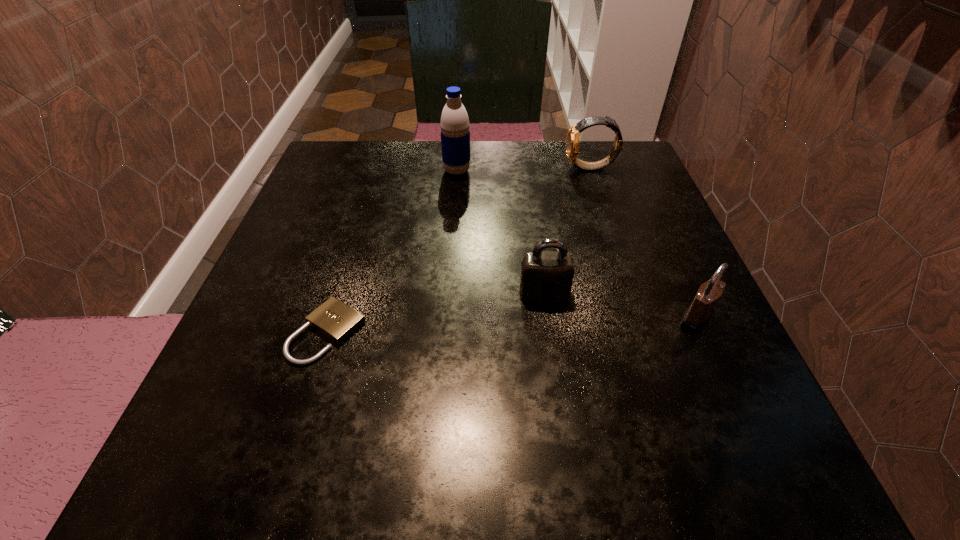
Choose which padlock is the nearest neighbor to the second padlock from left to right. Please provide its 2D coordinates. Your answer should be formatted as a tuple, i.e. [(x, y)], where the tuple contains the x and y coordinates of a point satisfying the conditions above.

[(698, 314)]

What are the coordinates of `padlock that is the second closest one to the watch` in the screenshot? It's located at (698, 314).

You are a GUI agent. You are given a task and a screenshot of the screen. Output one action in this format:
    pyautogui.click(x=<x>, y=<y>)
    Task: Click on the vacant region that satisfies the following two spatial constraints: 1. on the back side of the water bottle; 2. on the left side of the leftmost object
    
    Given the screenshot: What is the action you would take?
    pyautogui.click(x=377, y=171)

I want to click on free space that satisfies the following two spatial constraints: 1. on the face of the rightmost padlock; 2. on the left side of the watch, so coord(641,318).

Where is `vacant region that satisfies the following two spatial constraints: 1. at the front of the rightmost padlock near the keyhole; 2. on the right side of the second padlock from right to left`? vacant region that satisfies the following two spatial constraints: 1. at the front of the rightmost padlock near the keyhole; 2. on the right side of the second padlock from right to left is located at coordinates (547, 318).

Where is `free location that satisfies the following two spatial constraints: 1. on the face of the watch; 2. on the right side of the rightmost padlock`? free location that satisfies the following two spatial constraints: 1. on the face of the watch; 2. on the right side of the rightmost padlock is located at coordinates (641, 318).

Find the location of a particular element. free point that satisfies the following two spatial constraints: 1. on the back side of the leftmost object; 2. on the left side of the rightmost padlock is located at coordinates (332, 318).

I want to click on free space that satisfies the following two spatial constraints: 1. on the face of the watch; 2. at the front of the second padlock from right to left near the keyhole, so click(633, 292).